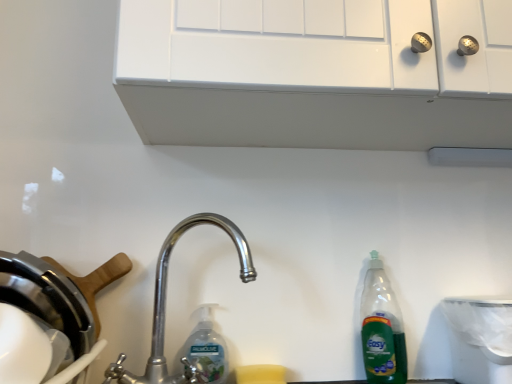
Question: Is clear plastic bottle at center not inside polished metal faucet at center?

Choices:
 (A) yes
 (B) no

Answer: (B)

Question: Is polished metal faucet at center located within clear plastic bottle at center?

Choices:
 (A) yes
 (B) no

Answer: (B)

Question: Considering the relative sizes of clear plastic bottle at center and polished metal faucet at center in the image provided, is clear plastic bottle at center wider than polished metal faucet at center?

Choices:
 (A) yes
 (B) no

Answer: (B)

Question: Is clear plastic bottle at center taller than polished metal faucet at center?

Choices:
 (A) no
 (B) yes

Answer: (A)

Question: Is clear plastic bottle at center bigger than polished metal faucet at center?

Choices:
 (A) no
 (B) yes

Answer: (A)

Question: From the image's perspective, would you say clear plastic bottle at center is shown under polished metal faucet at center?

Choices:
 (A) no
 (B) yes

Answer: (B)

Question: Is green plastic bottle at right oriented towards white plastic trash can at lower right?

Choices:
 (A) no
 (B) yes

Answer: (A)

Question: Considering the relative positions of green plastic bottle at right and white plastic trash can at lower right in the image provided, is green plastic bottle at right in front of white plastic trash can at lower right?

Choices:
 (A) yes
 (B) no

Answer: (B)

Question: From a real-world perspective, is green plastic bottle at right physically below white plastic trash can at lower right?

Choices:
 (A) no
 (B) yes

Answer: (A)

Question: From the image's perspective, is green plastic bottle at right beneath white plastic trash can at lower right?

Choices:
 (A) no
 (B) yes

Answer: (A)

Question: Is green plastic bottle at right not inside white plastic trash can at lower right?

Choices:
 (A) no
 (B) yes

Answer: (B)

Question: Is green plastic bottle at right shorter than white plastic trash can at lower right?

Choices:
 (A) no
 (B) yes

Answer: (A)

Question: From the image's perspective, is polished metal faucet at center on white plastic trash can at lower right?

Choices:
 (A) no
 (B) yes

Answer: (B)